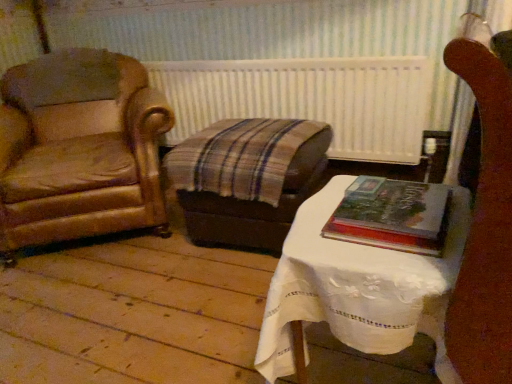
Question: From a real-world perspective, is white lace-covered table at center above or below white textured radiator at center?

Choices:
 (A) below
 (B) above

Answer: (A)

Question: Is white lace-covered table at center to the left or to the right of white textured radiator at center in the image?

Choices:
 (A) right
 (B) left

Answer: (A)

Question: Which object is the closest to the white lace-covered table at center?

Choices:
 (A) brown leather armchair at left
 (B) hardcover book at center right
 (C) white textured radiator at center

Answer: (B)

Question: Which of these objects is positioned closest to the white textured radiator at center?

Choices:
 (A) white lace-covered table at center
 (B) brown leather armchair at left
 (C) hardcover book at center right

Answer: (B)